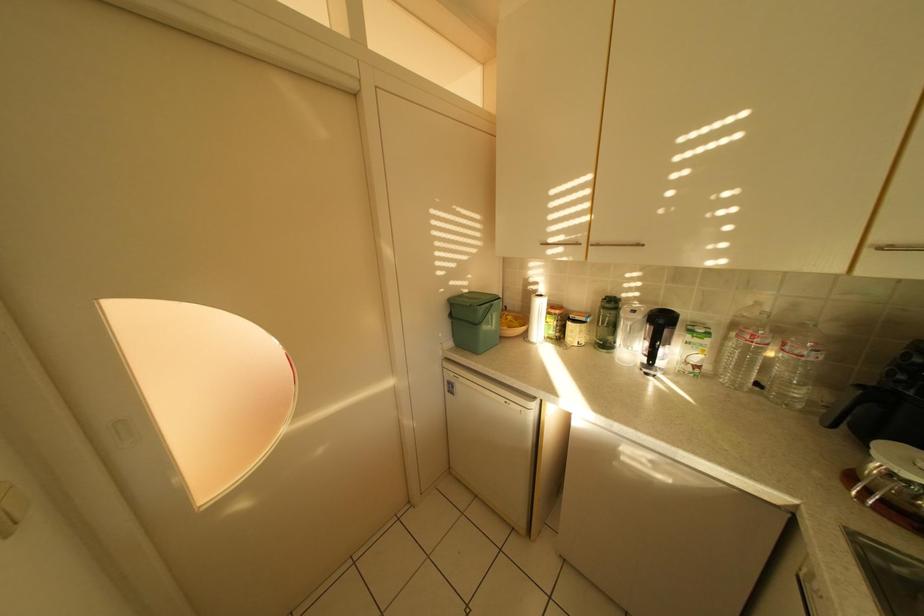
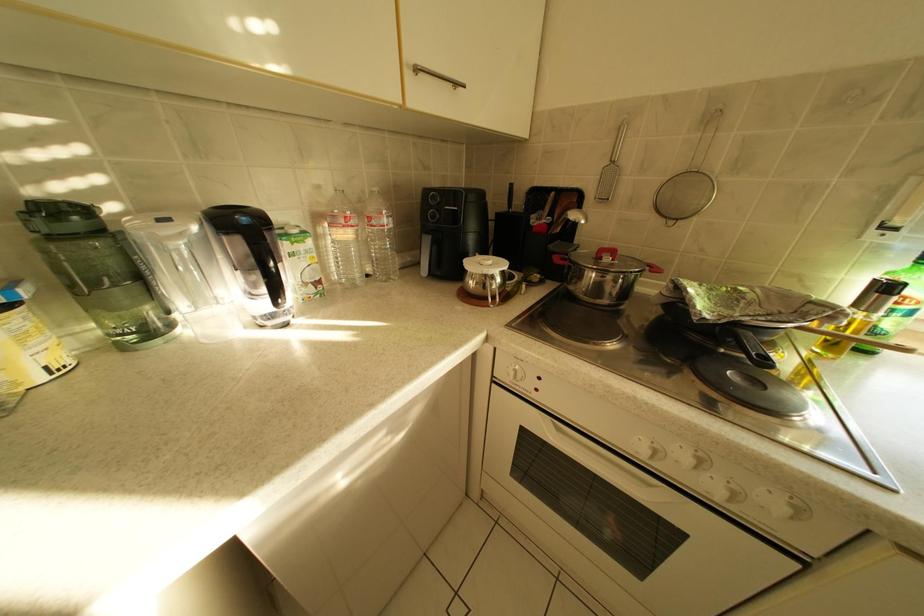
How did the camera likely rotate?

The camera rotated toward right-down.